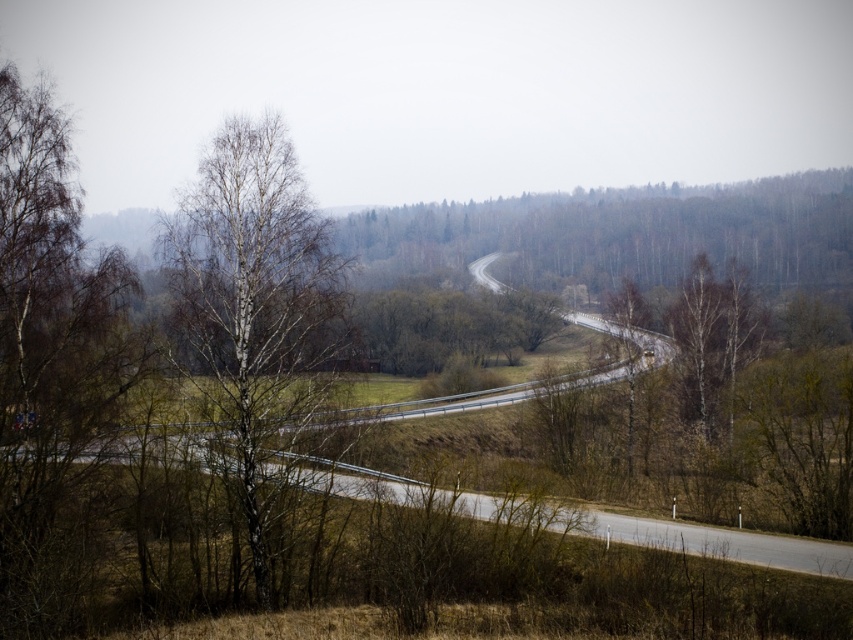
Is white bark tree at center bigger than asphalt road at center?

No, white bark tree at center is not bigger than asphalt road at center.

Find the location of a particular element. This screenshot has width=853, height=640. white bark tree at center is located at coordinates (254, 307).

Where is `white bark tree at center`? This screenshot has width=853, height=640. white bark tree at center is located at coordinates (254, 307).

The image size is (853, 640). I want to click on white bark tree at center, so click(x=254, y=307).